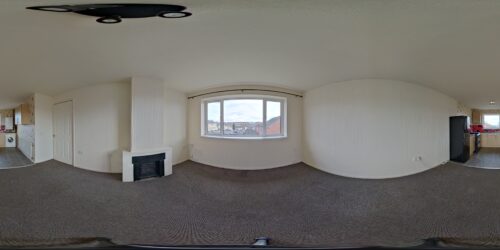
Locate an element on the screen. This screenshot has height=250, width=500. black refridgerator is located at coordinates (462, 141).